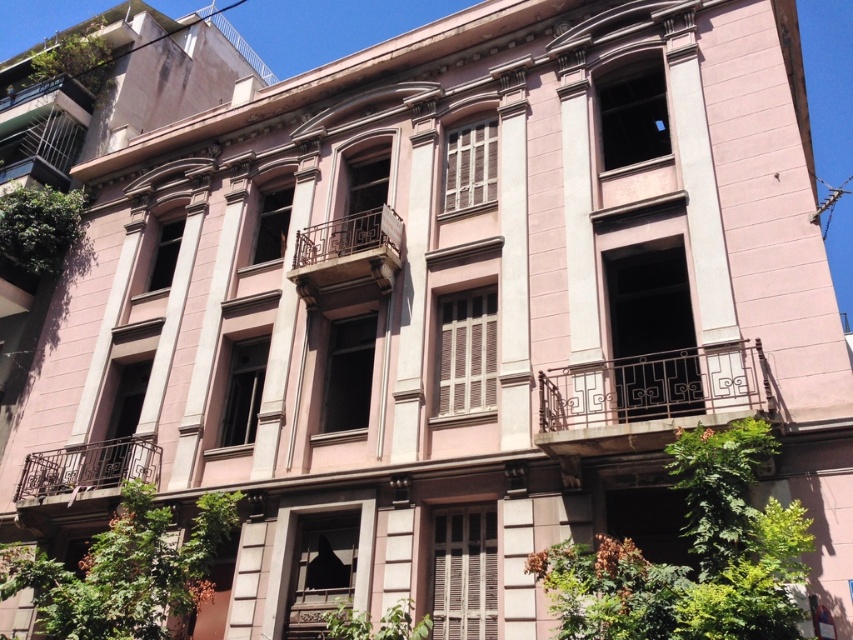
Can you confirm if iron-patterned balcony at center-right is positioned above rustic metal balcony at center?

Incorrect, iron-patterned balcony at center-right is not positioned above rustic metal balcony at center.

Can you confirm if iron-patterned balcony at center-right is positioned to the left of rustic metal balcony at center?

Incorrect, iron-patterned balcony at center-right is not on the left side of rustic metal balcony at center.

Is point (561, 433) more distant than point (379, 264)?

That is False.

Find the location of a particular element. iron-patterned balcony at center-right is located at coordinates (648, 397).

The image size is (853, 640). What do you see at coordinates (347, 252) in the screenshot?
I see `rustic metal balcony at center` at bounding box center [347, 252].

Is rustic metal balcony at center below brown wrought iron balcony at lower left?

No, rustic metal balcony at center is not below brown wrought iron balcony at lower left.

Who is more forward, (317, 289) or (80, 465)?

Point (317, 289) is more forward.

Where is `rustic metal balcony at center`? The image size is (853, 640). rustic metal balcony at center is located at coordinates (347, 252).

Does iron-patterned balcony at center-right have a lesser height compared to brown wrought iron balcony at lower left?

In fact, iron-patterned balcony at center-right may be taller than brown wrought iron balcony at lower left.

Looking at this image, does iron-patterned balcony at center-right lie in front of brown wrought iron balcony at lower left?

Yes, iron-patterned balcony at center-right is closer to the viewer.

Where is `iron-patterned balcony at center-right`? The height and width of the screenshot is (640, 853). iron-patterned balcony at center-right is located at coordinates (648, 397).

Identify the location of iron-patterned balcony at center-right. Image resolution: width=853 pixels, height=640 pixels. (648, 397).